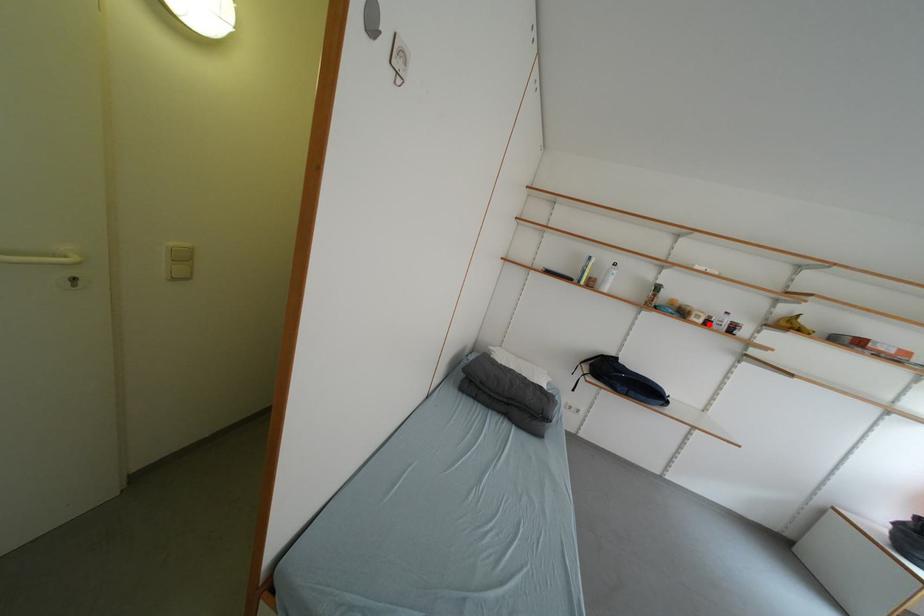
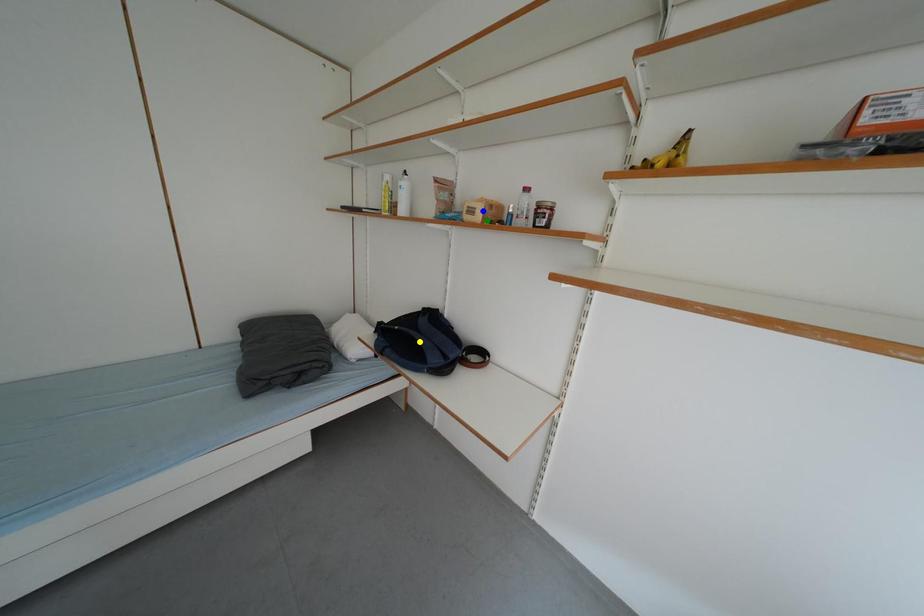
Question: I am providing you with two images of the same scene from different viewpoints. A red point is marked on the first image. You are given multiple points on the second image. Can you choose the point in image 2 that corresponds to the point in image 1?

Choices:
 (A) yellow point
 (B) green point
 (C) blue point

Answer: (B)